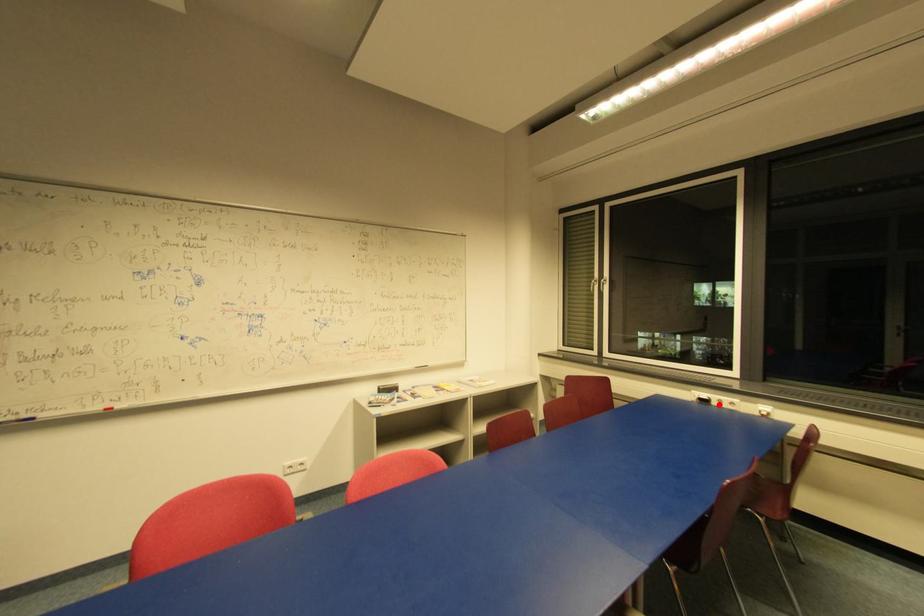
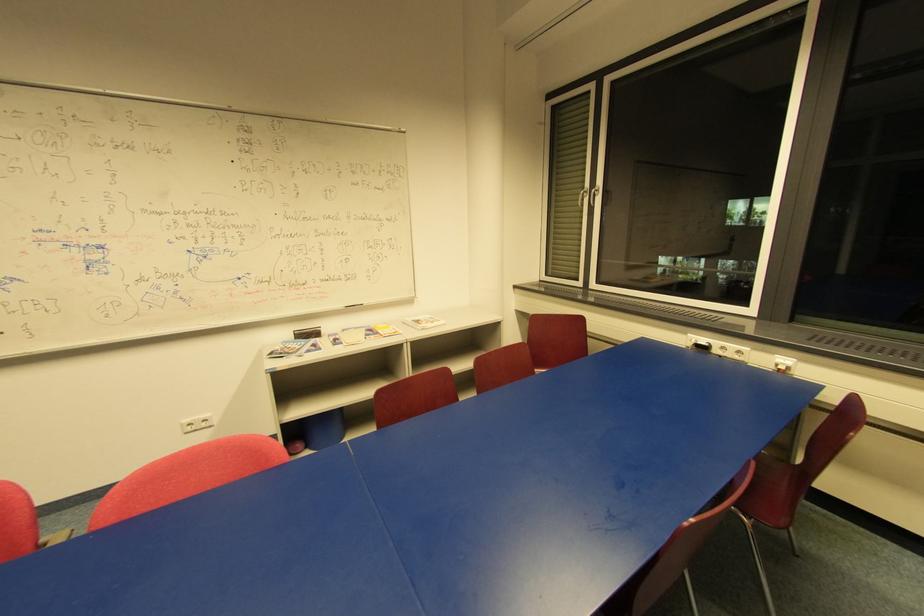
The point at the highlighted location is marked in the first image. Where is the corresponding point in the second image?

(720, 352)